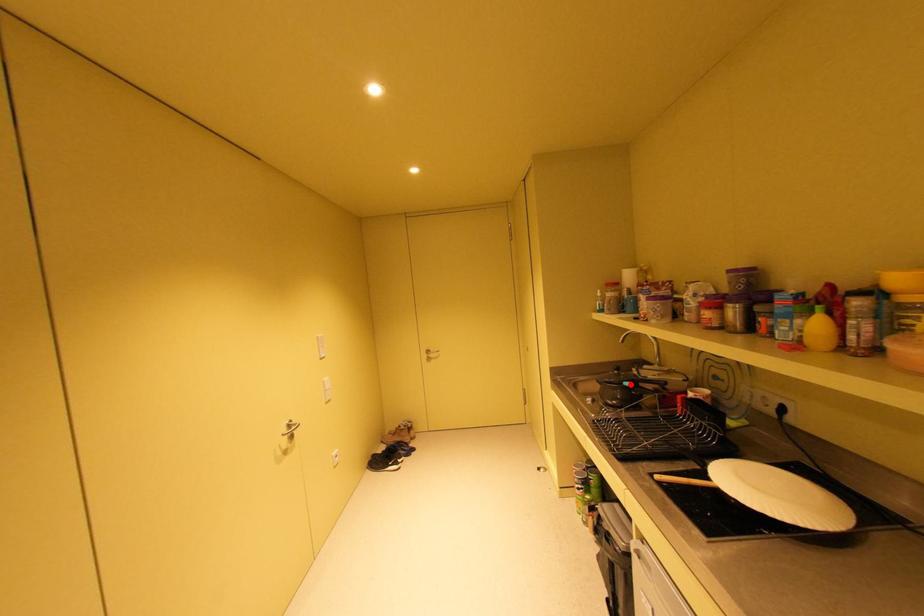
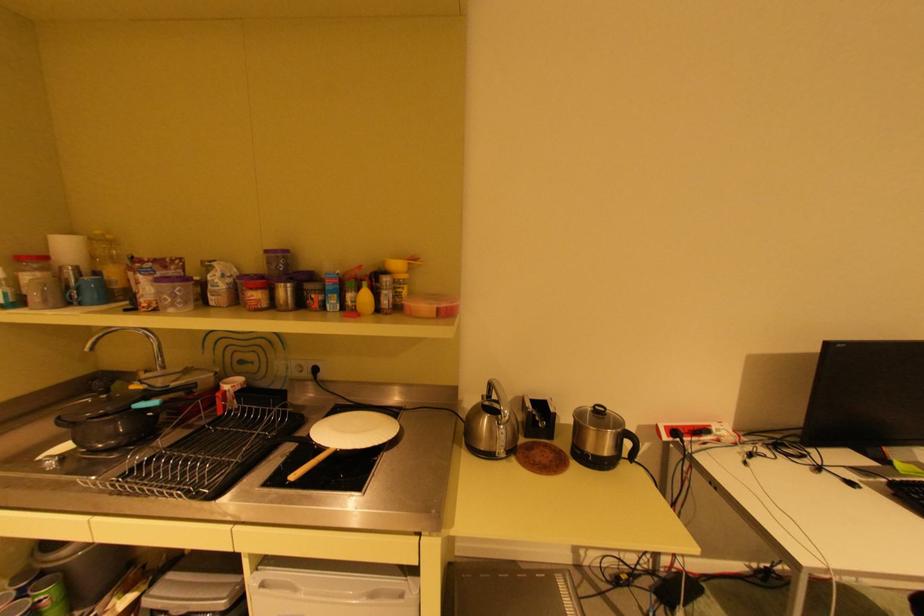
Find the pixel in the second image that matches the highlighted location in the first image.

(139, 408)